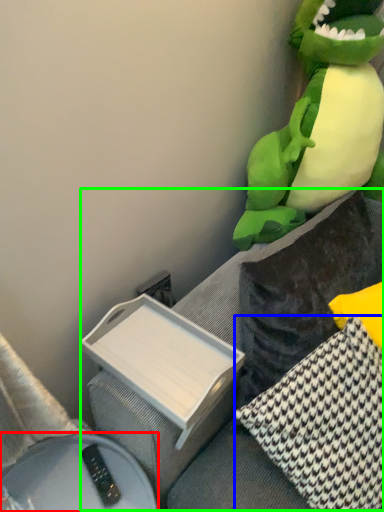
Question: Which object is positioned closest to furniture (highlighted by a red box)? Select from pillow (highlighted by a blue box) and couch (highlighted by a green box).

Choices:
 (A) pillow
 (B) couch

Answer: (B)